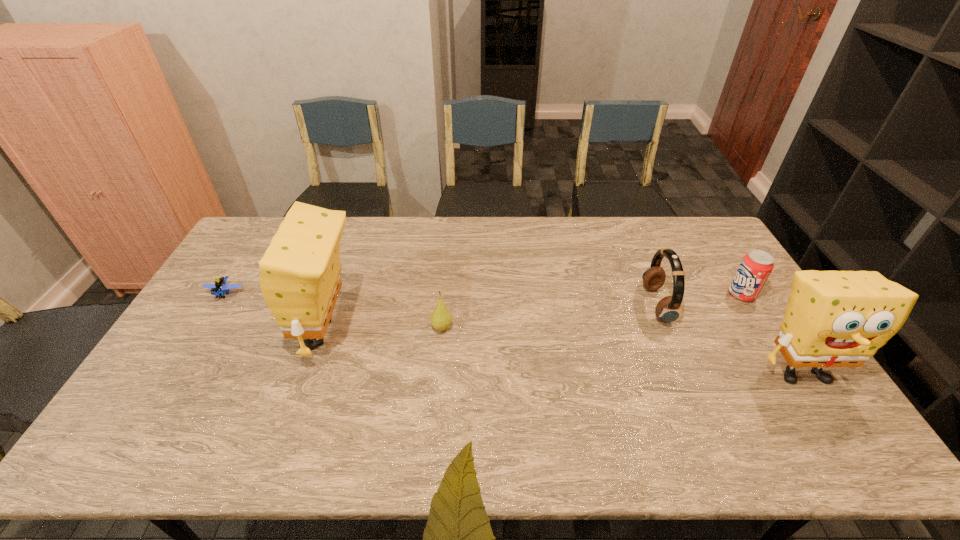
This screenshot has height=540, width=960. I want to click on object that is the fifth closest to the right sponge, so coord(220,286).

Identify the location of object that is the nearest to the Lego. Image resolution: width=960 pixels, height=540 pixels. (300, 280).

In order to click on free spot that satisfies the following two spatial constraints: 1. on the front-facing side of the shortest object; 2. on the left side of the fifth tallest object in this screenshot , I will do `click(205, 328)`.

Find the location of a particular element. The image size is (960, 540). free space that satisfies the following two spatial constraints: 1. on the front side of the third object from left to right; 2. on the face of the second object from left to right is located at coordinates pyautogui.click(x=442, y=333).

Image resolution: width=960 pixels, height=540 pixels. I want to click on free location that satisfies the following two spatial constraints: 1. on the front side of the second shortest object; 2. on the face of the left sponge, so click(x=442, y=333).